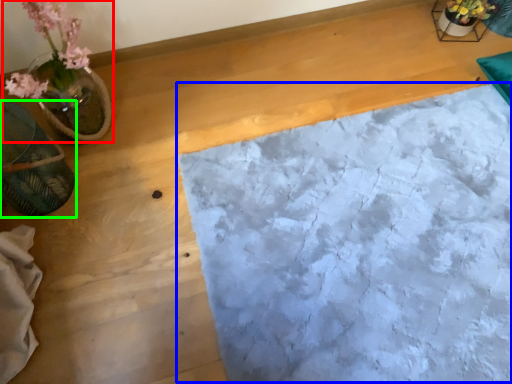
Question: Based on their relative distances, which object is nearer to houseplant (highlighted by a red box)? Choose from sheet (highlighted by a blue box) and flowerpot (highlighted by a green box).

Choices:
 (A) sheet
 (B) flowerpot

Answer: (B)